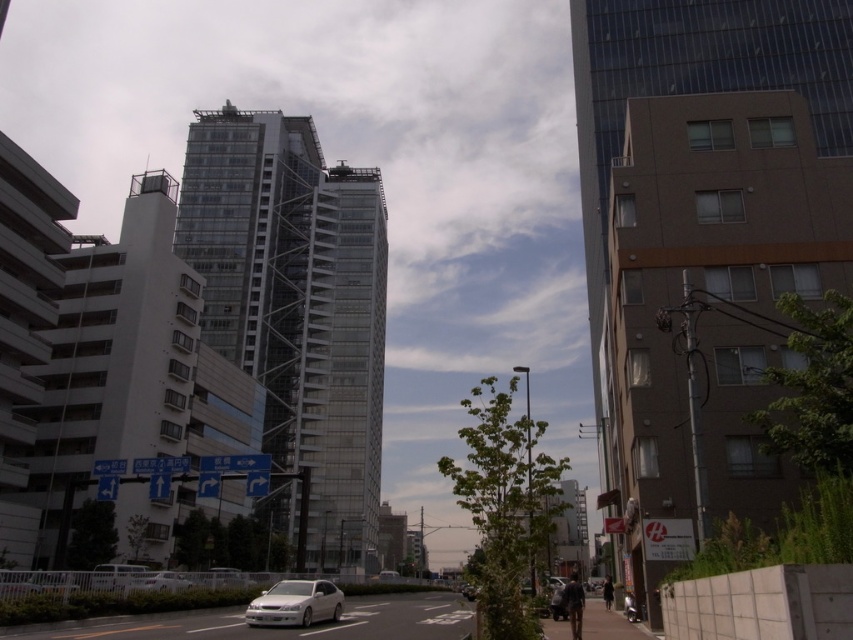
Question: Estimate the real-world distances between objects in this image. Which object is farther from the white glossy sedan at center?

Choices:
 (A) glassy reflective tower at center
 (B) transparent glass building at center

Answer: (B)

Question: Is glassy reflective tower at center positioned before white glossy sedan at center?

Choices:
 (A) yes
 (B) no

Answer: (A)

Question: Which of the following is the farthest from the observer?

Choices:
 (A) transparent glass building at center
 (B) white glossy sedan at center
 (C) glassy reflective tower at center

Answer: (A)

Question: Is glassy reflective tower at center further to camera compared to transparent glass building at center?

Choices:
 (A) no
 (B) yes

Answer: (A)

Question: Is glassy reflective tower at center wider than white glossy sedan at center?

Choices:
 (A) yes
 (B) no

Answer: (A)

Question: Which point is closer to the camera taking this photo?

Choices:
 (A) (372, 227)
 (B) (291, 600)
 (C) (676, 276)

Answer: (B)